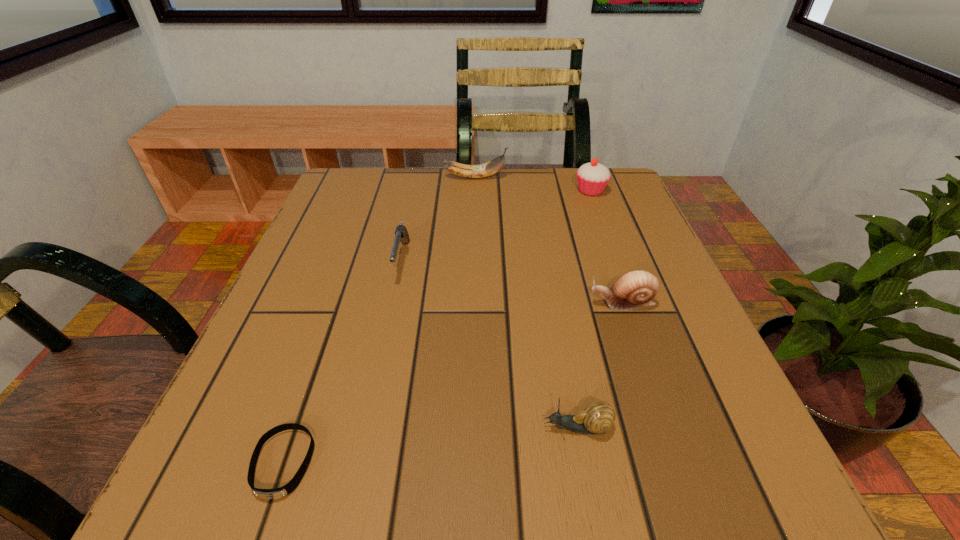
Locate an element on the screen. This screenshot has height=540, width=960. banana is located at coordinates (492, 167).

This screenshot has width=960, height=540. Find the location of `the third object from left to right`. the third object from left to right is located at coordinates (492, 167).

Locate an element on the screen. cupcake is located at coordinates (592, 178).

Where is `the taller escargot`? The height and width of the screenshot is (540, 960). the taller escargot is located at coordinates (636, 289).

What are the coordinates of `the right escargot` in the screenshot? It's located at (636, 289).

Locate an element on the screen. gun is located at coordinates (401, 234).

Image resolution: width=960 pixels, height=540 pixels. Identify the location of the fourth nearest object. (401, 234).

The height and width of the screenshot is (540, 960). Find the location of `the shorter escargot`. the shorter escargot is located at coordinates (598, 417).

Identify the location of the left escargot. (598, 417).

Where is `wristband`? The height and width of the screenshot is (540, 960). wristband is located at coordinates (269, 494).